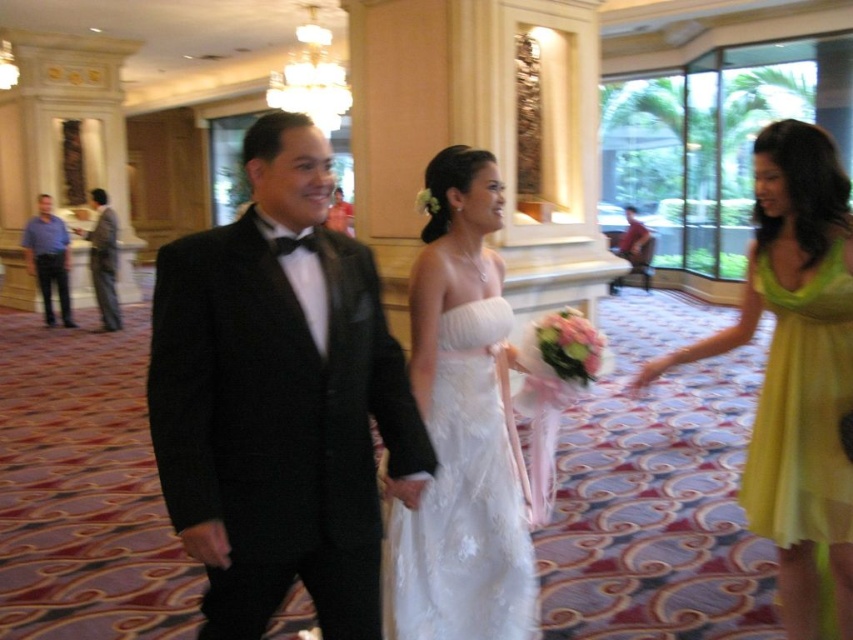
Locate an element on the screen. This screenshot has height=640, width=853. white satin dress at center is located at coordinates (465, 499).

Identify the location of white satin dress at center. This screenshot has height=640, width=853. tap(465, 499).

Does shiny black tuxedo at center have a lesser height compared to blue shirt at left?

Indeed, shiny black tuxedo at center has a lesser height compared to blue shirt at left.

Does point (305, 125) come farther from viewer compared to point (65, 305)?

No, (305, 125) is in front of (65, 305).

Between point (265, 426) and point (50, 202), which one is positioned behind?

The point (50, 202) is behind.

Locate an element on the screen. The height and width of the screenshot is (640, 853). shiny black tuxedo at center is located at coordinates (279, 397).

Who is more distant from viewer, (x=802, y=372) or (x=109, y=316)?

The point (x=109, y=316) is behind.

Can you confirm if green satin dress at right is bigger than shiny black suit at left?

Incorrect, green satin dress at right is not larger than shiny black suit at left.

Where is `green satin dress at right`? green satin dress at right is located at coordinates (802, 410).